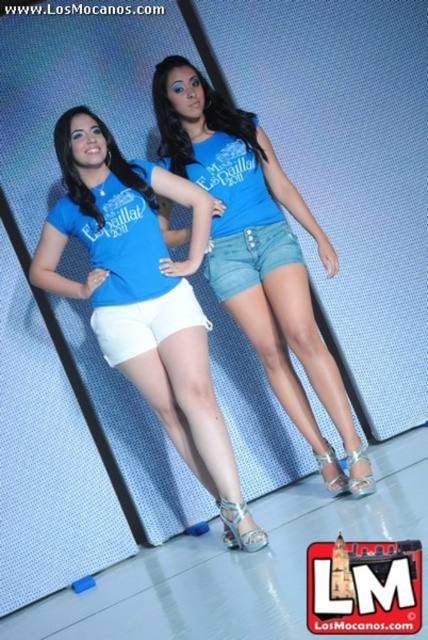
At what (x,y) coordinates should I click in order to perform the action: click on matte blue denim shorts at center. Please return your answer as a coordinate pair (x, y). This screenshot has width=428, height=640. Looking at the image, I should click on (259, 253).

Is matte blue denim shorts at center above matte blue t-shirt at center?

Yes, matte blue denim shorts at center is above matte blue t-shirt at center.

Is point (253, 336) positioned before point (101, 220)?

No.

The height and width of the screenshot is (640, 428). What are the coordinates of `matte blue denim shorts at center` in the screenshot? It's located at (259, 253).